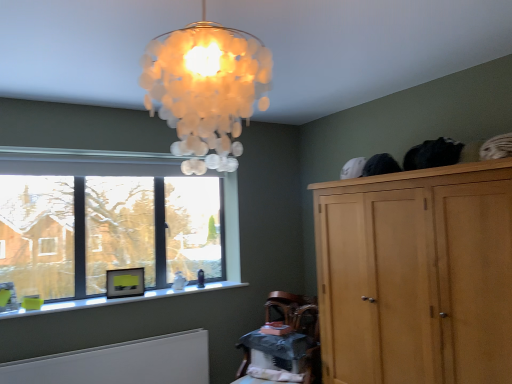
Question: Is clear glass window at lower left to the left or to the right of wooden table at lower center in the image?

Choices:
 (A) right
 (B) left

Answer: (B)

Question: Considering the positions of clear glass window at lower left and wooden table at lower center in the image, is clear glass window at lower left taller or shorter than wooden table at lower center?

Choices:
 (A) short
 (B) tall

Answer: (B)

Question: Estimate the real-world distances between objects in this image. Which object is closer to the translucent glass lampshade at upper center?

Choices:
 (A) light brown wooden cupboard at upper right
 (B) wooden armchair at lower center
 (C) clear glass window at lower left
 (D) wooden table at lower center
 (E) white matte radiator at lower left

Answer: (A)

Question: Estimate the real-world distances between objects in this image. Which object is closer to the clear glass window at lower left?

Choices:
 (A) white glossy frame at lower left
 (B) white matte radiator at lower left
 (C) wooden table at lower center
 (D) translucent glass lampshade at upper center
 (E) wooden armchair at lower center

Answer: (A)